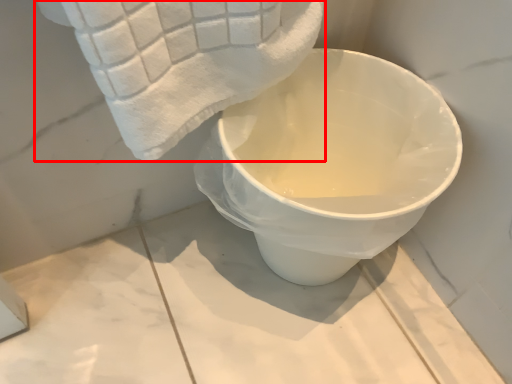
Question: Observing the image, what is the correct spatial positioning of towel (annotated by the red box) in reference to toilet?

Choices:
 (A) left
 (B) right

Answer: (A)